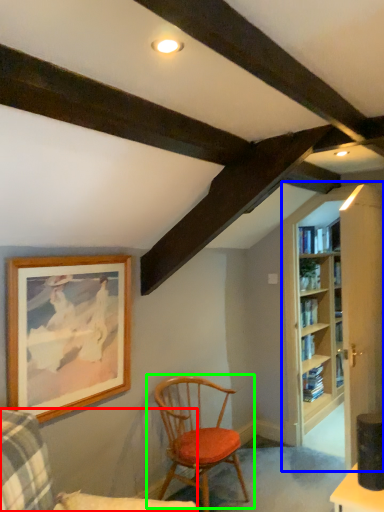
Question: Which is nearer to the chair (highlighted by a red box)? bookcase (highlighted by a blue box) or chair (highlighted by a green box).

Choices:
 (A) bookcase
 (B) chair

Answer: (B)